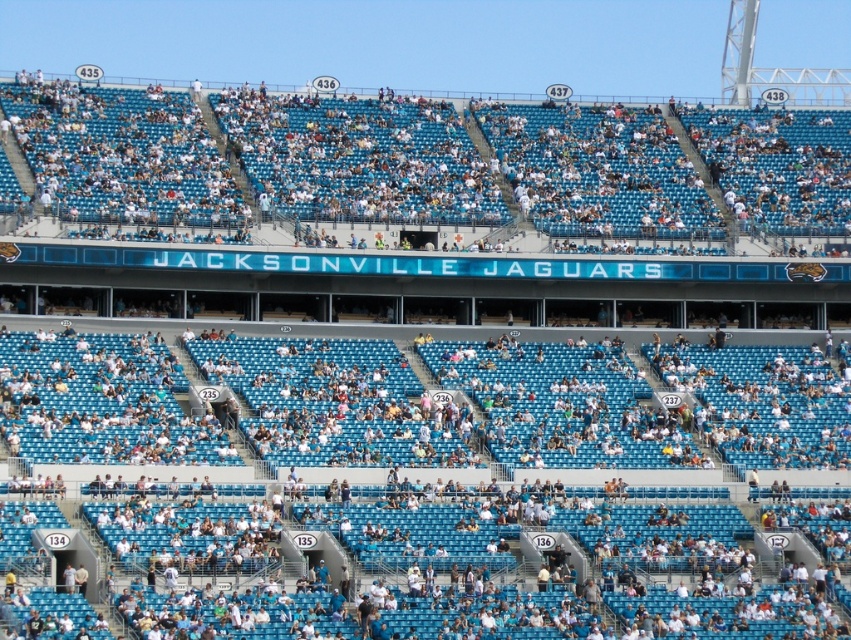
Is point (1, 346) closer to viewer compared to point (151, 170)?

That is True.

Identify the location of white plastic seats at center. (431, 556).